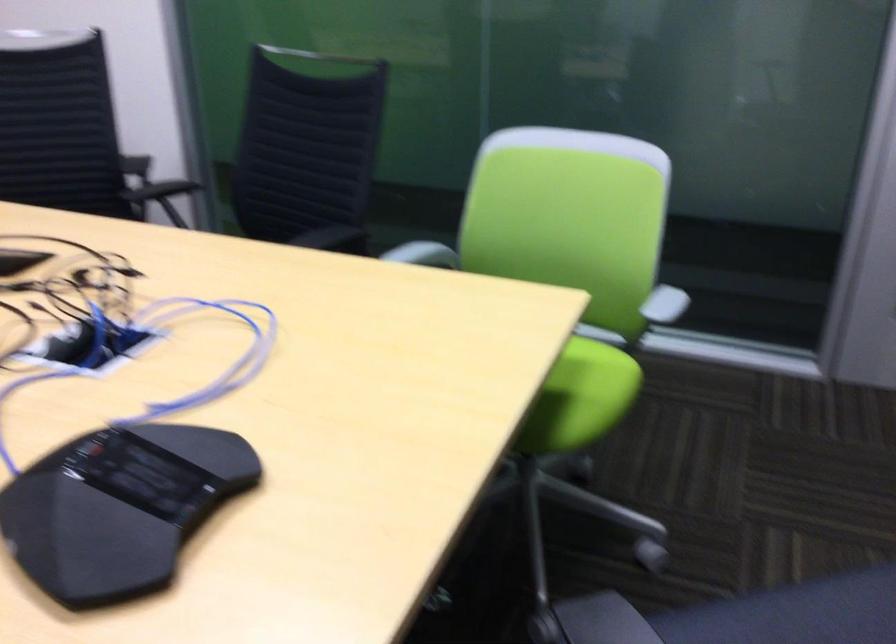
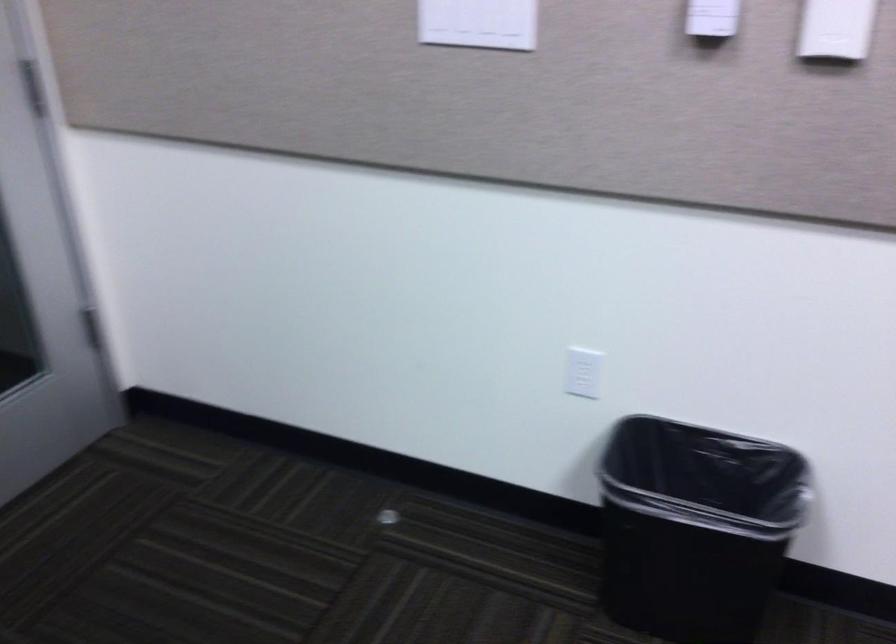
First-person continuous shooting, in which direction is the camera rotating?

The camera rotated toward right-down.